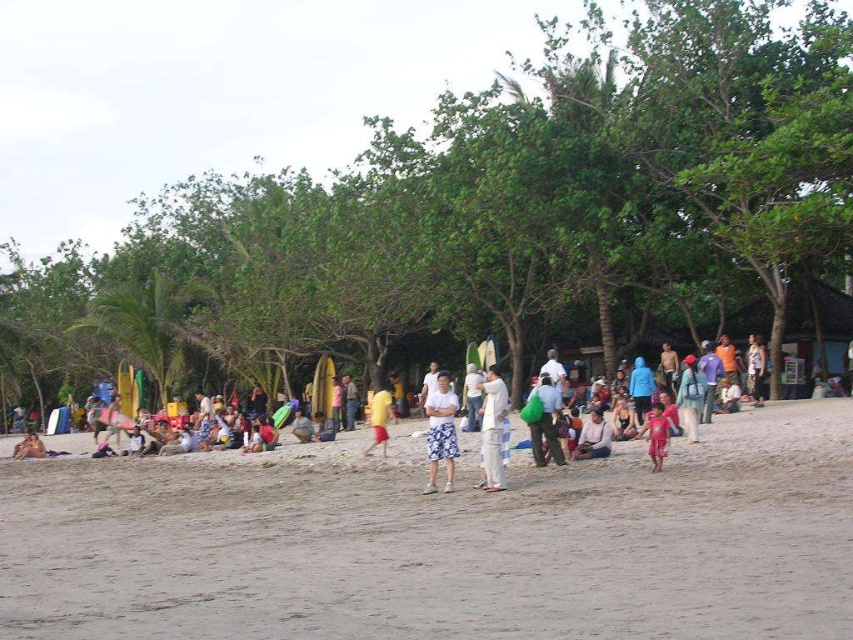
You are a photographer trying to capture a clear shot of the white cotton shirt at center and the light brown wooden chair at center. Since you want both subjects to be visible, which object should you focus on first to ensure depth of field?

The white cotton shirt at center is taller than the light brown wooden chair at center, so focusing on the taller object first will help ensure both are in focus.

You are standing at the point labeled point (538, 376) and want to walk to the point labeled point (53, 554). Which direction should you move in to reach your destination?

To reach point (53, 554) from point (538, 376), you should move forward since point (53, 554) is in front of point (538, 376).